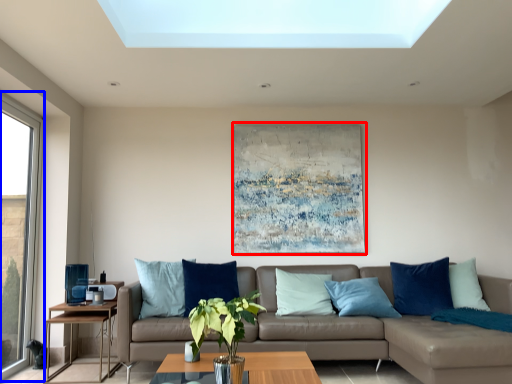
Question: Which object is further to the camera taking this photo, picture frame (highlighted by a red box) or window (highlighted by a blue box)?

Choices:
 (A) picture frame
 (B) window

Answer: (A)